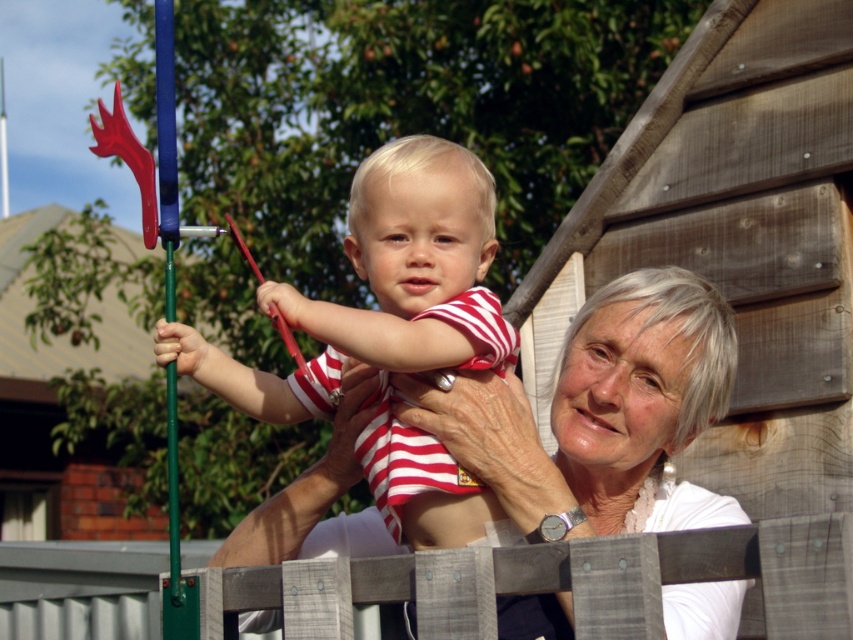
You are a photographer setting up a shot of the striped cotton shirt at center and the wooden fence at center. The camera frame is 1 meter wide. Which object should you focus on to ensure it fits entirely within the frame without cropping?

The striped cotton shirt at center is wider than the wooden fence at center, so focusing on the striped cotton shirt at center ensures it fits within the 1 meter frame without cropping.